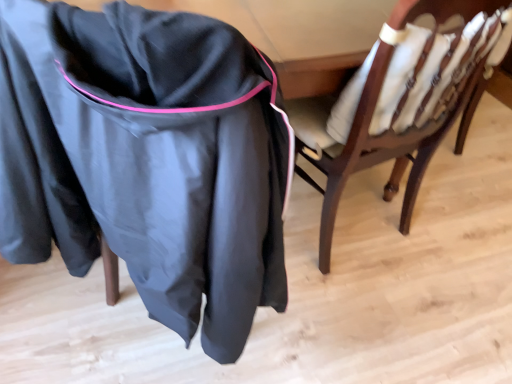
In order to click on vacant area that is situated to the right of wooden chair with white cushions at center in this screenshot , I will do `click(453, 235)`.